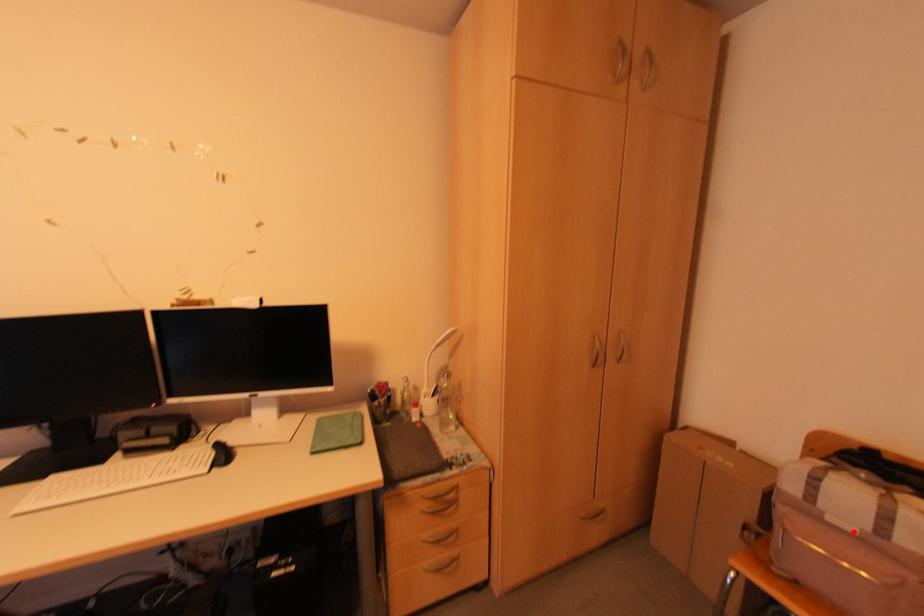
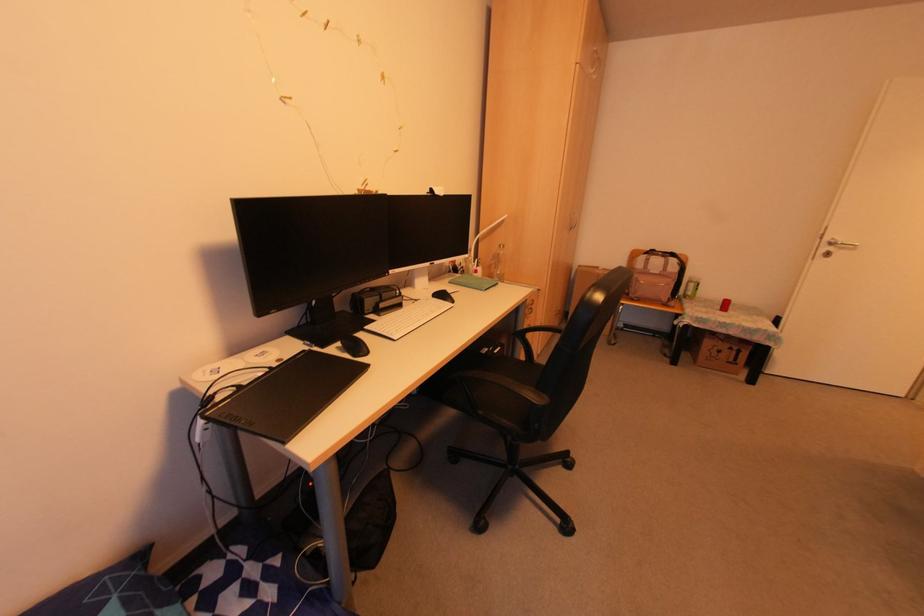
The point at the highlighted location is marked in the first image. Where is the corresponding point in the second image?

(655, 273)